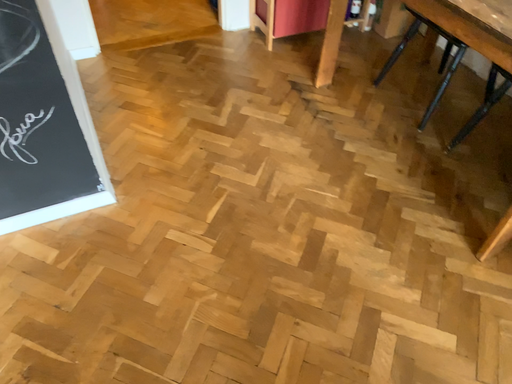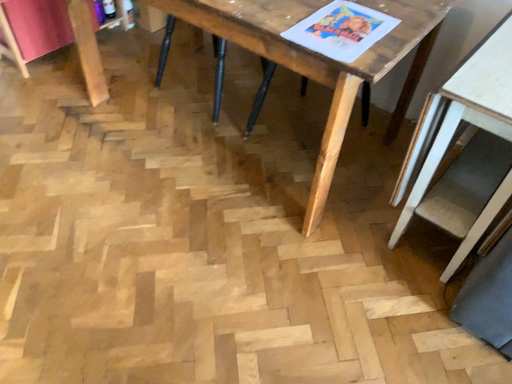
Question: Which way did the camera rotate in the video?

Choices:
 (A) rotated right
 (B) rotated left

Answer: (A)